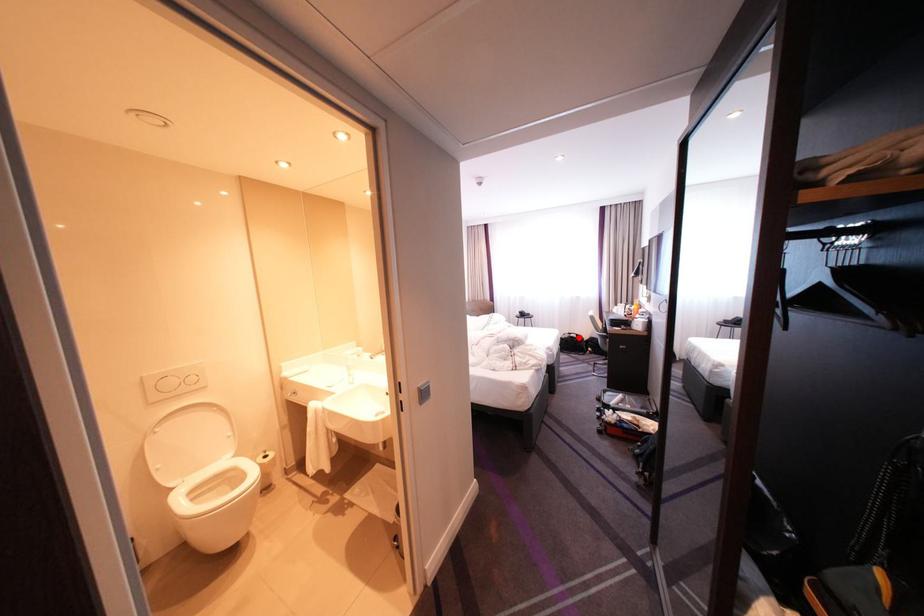
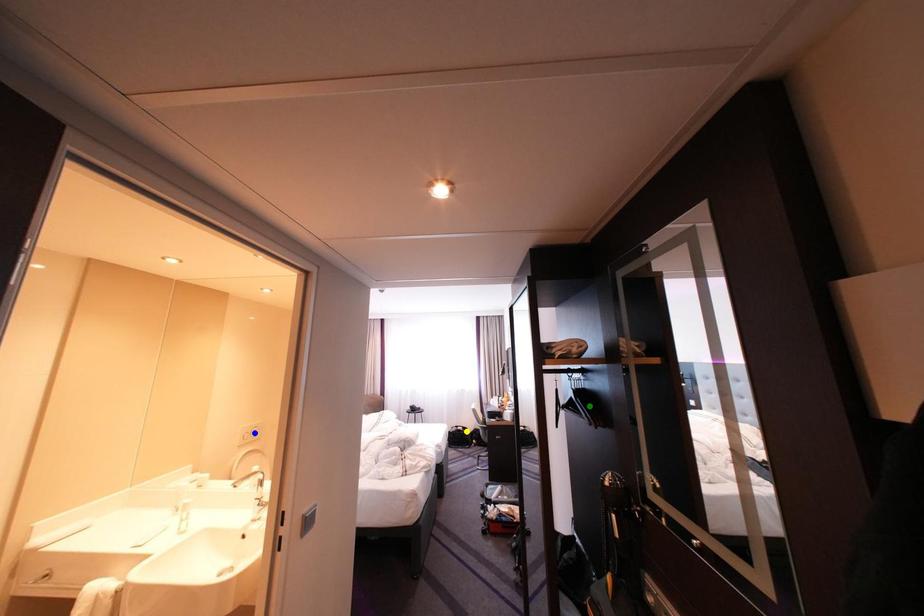
Question: I am providing you with two images of the same scene from different viewpoints. A red point is marked on the first image. You are given multiple points on the second image. Which mark in image 2 goes with the point in image 1?

Choices:
 (A) green point
 (B) yellow point
 (C) blue point

Answer: (B)